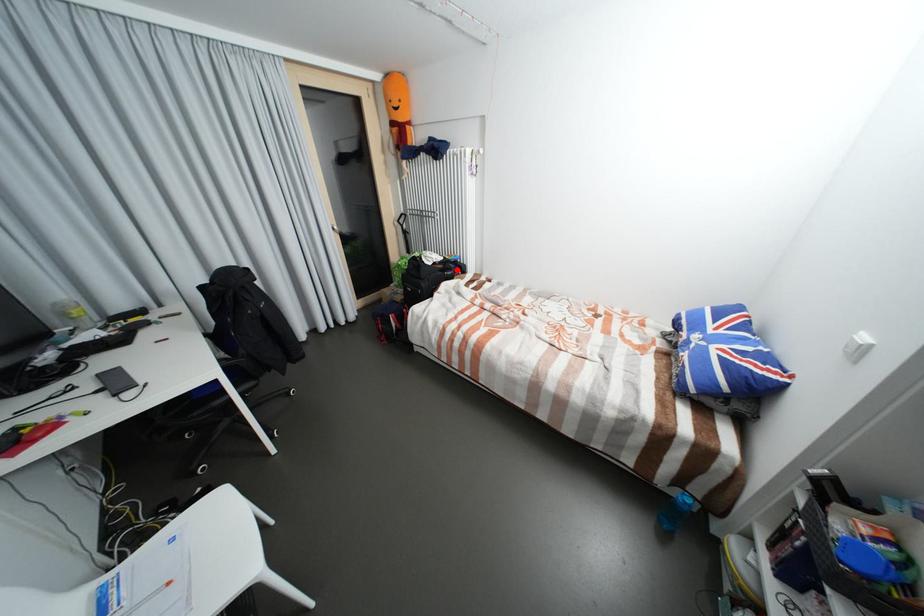
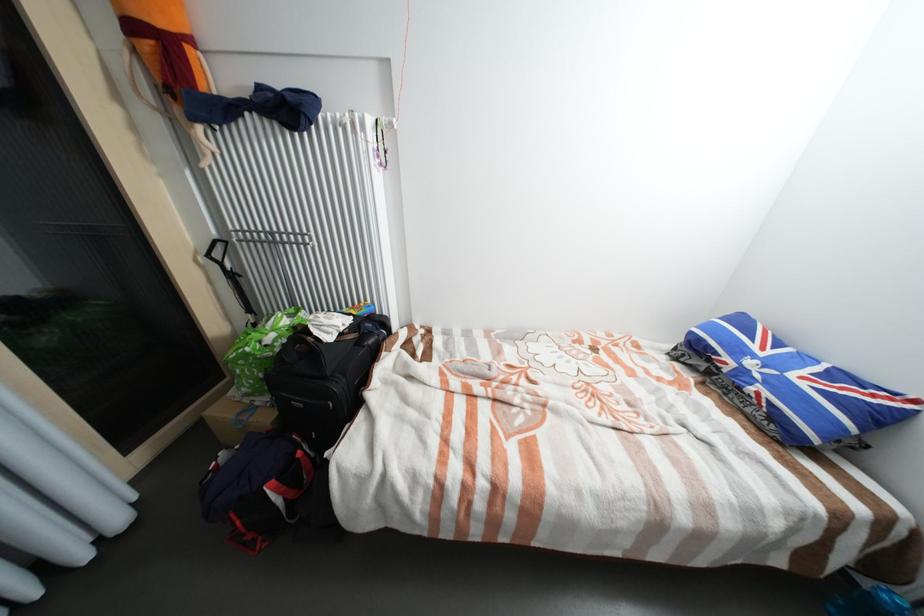
Where in the second image is the point corresponding to the highlighted location from the first image?

(377, 334)